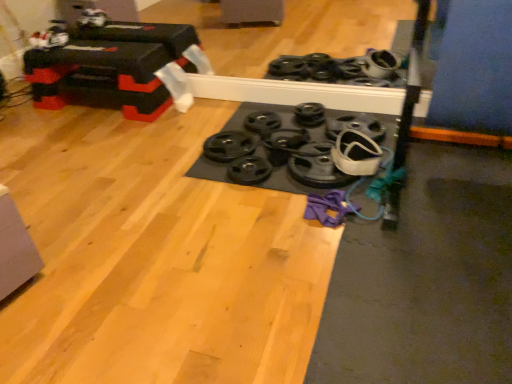
Question: Can you confirm if black rubber weights at center, marked as the first wheel in a left-to-right arrangement, is thinner than black rubber weight plate at center, which appears as the 3th wheel when viewed from the right?

Choices:
 (A) yes
 (B) no

Answer: (B)

Question: From the image's perspective, is black rubber weights at center, the sixth wheel positioned from the right, under black rubber weight plate at center, the fourth wheel positioned from the left?

Choices:
 (A) yes
 (B) no

Answer: (A)

Question: From a real-world perspective, is black rubber weights at center, the sixth wheel positioned from the right, physically above black rubber weight plate at center, the fourth wheel positioned from the left?

Choices:
 (A) no
 (B) yes

Answer: (A)

Question: Can you confirm if black rubber weights at center, the sixth wheel positioned from the right, is smaller than black rubber weight plate at center, which appears as the 3th wheel when viewed from the right?

Choices:
 (A) no
 (B) yes

Answer: (B)

Question: From the image's perspective, is black rubber weights at center, the sixth wheel positioned from the right, on black rubber weight plate at center, which appears as the 3th wheel when viewed from the right?

Choices:
 (A) no
 (B) yes

Answer: (A)

Question: Considering the positions of point (275, 122) and point (307, 144), is point (275, 122) closer or farther from the camera than point (307, 144)?

Choices:
 (A) closer
 (B) farther

Answer: (B)

Question: Considering the positions of black rubber weight plate at center, positioned as the 5th wheel in right-to-left order, and black rubber weight plate at center, acting as the 2th wheel starting from the right, in the image, is black rubber weight plate at center, positioned as the 5th wheel in right-to-left order, wider or thinner than black rubber weight plate at center, acting as the 2th wheel starting from the right,?

Choices:
 (A) thin
 (B) wide

Answer: (A)

Question: From a real-world perspective, is black rubber weight plate at center, positioned as the 5th wheel in right-to-left order, positioned above or below black rubber weight plate at center, acting as the 2th wheel starting from the right?

Choices:
 (A) above
 (B) below

Answer: (B)

Question: Based on their sizes in the image, would you say black rubber weight plate at center, positioned as the 5th wheel in right-to-left order, is bigger or smaller than black rubber weight plate at center, acting as the 2th wheel starting from the right?

Choices:
 (A) small
 (B) big

Answer: (A)

Question: Would you say black rubber weight plate at center, which appears as the 3th wheel when viewed from the right, is to the left or to the right of black rubber weight plate at center, placed as the 1th wheel when sorted from right to left, in the picture?

Choices:
 (A) left
 (B) right

Answer: (A)

Question: Based on their sizes in the image, would you say black rubber weight plate at center, the fourth wheel positioned from the left, is bigger or smaller than black rubber weight plate at center, which is counted as the 6th wheel, starting from the left?

Choices:
 (A) big
 (B) small

Answer: (B)

Question: From a real-world perspective, is black rubber weight plate at center, the fourth wheel positioned from the left, positioned above or below black rubber weight plate at center, which is counted as the 6th wheel, starting from the left?

Choices:
 (A) above
 (B) below

Answer: (A)

Question: Looking at their shapes, would you say black rubber weight plate at center, the fourth wheel positioned from the left, is wider or thinner than black rubber weight plate at center, placed as the 1th wheel when sorted from right to left?

Choices:
 (A) thin
 (B) wide

Answer: (A)

Question: Is black rubber weight plate at center, the 3th wheel viewed from the left, in front of or behind black rubber weight plate at center, positioned as the 5th wheel in right-to-left order, in the image?

Choices:
 (A) front
 (B) behind

Answer: (A)

Question: In terms of size, does black rubber weight plate at center, the 4th wheel viewed from the right, appear bigger or smaller than black rubber weight plate at center, positioned as the 5th wheel in right-to-left order?

Choices:
 (A) small
 (B) big

Answer: (A)